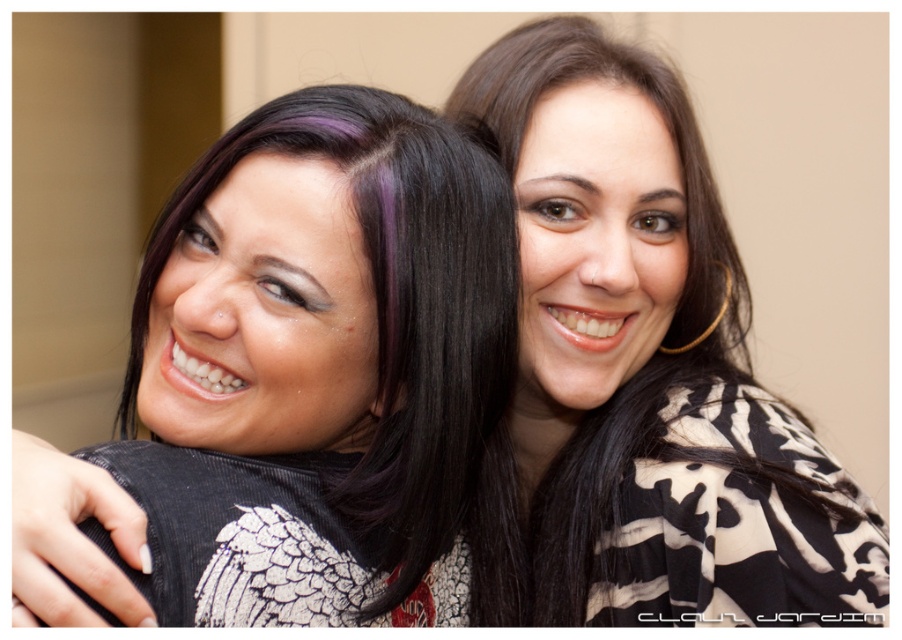
Does matte black hair at left have a greater width compared to black printed shirt at center?

Incorrect, matte black hair at left's width does not surpass black printed shirt at center's.

Between point (153, 476) and point (608, 589), which one is positioned behind?

Point (608, 589)

Is point (318, 92) in front of point (560, 218)?

Yes, point (318, 92) is closer to viewer.

The image size is (902, 640). Find the location of `matte black hair at left`. matte black hair at left is located at coordinates (318, 368).